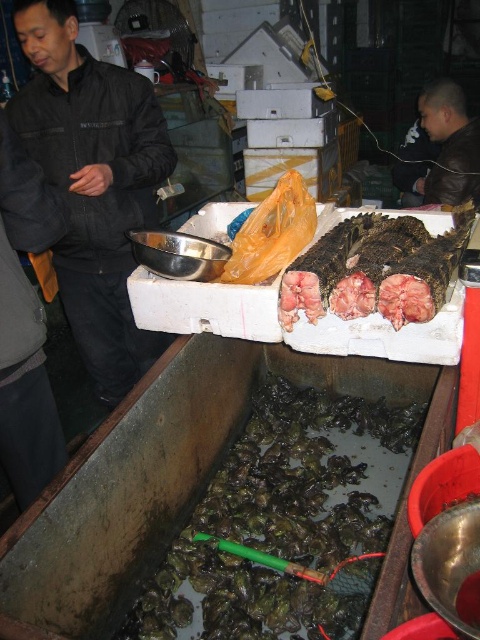
Question: Does dark brown rubber oyster at lower left lie in front of dark matte jacket at left?

Choices:
 (A) yes
 (B) no

Answer: (A)

Question: Among these points, which one is nearest to the camera?

Choices:
 (A) (347, 618)
 (B) (332, 241)
 (C) (439, 86)
 (D) (105, 227)

Answer: (A)

Question: Does dark matte jacket at left have a larger size compared to dark brown textured fish at upper center?

Choices:
 (A) yes
 (B) no

Answer: (A)

Question: Does dark brown rubber oyster at lower left have a smaller size compared to dark matte jacket at left?

Choices:
 (A) yes
 (B) no

Answer: (A)

Question: Which of the following is the closest to the observer?

Choices:
 (A) dark brown textured fish at upper center
 (B) dark brown rubber oyster at lower left

Answer: (A)

Question: Among these objects, which one is farthest from the camera?

Choices:
 (A) brown leather jacket at upper right
 (B) dark brown textured fish at upper center
 (C) dark matte jacket at left
 (D) dark brown rubber oyster at lower left

Answer: (A)